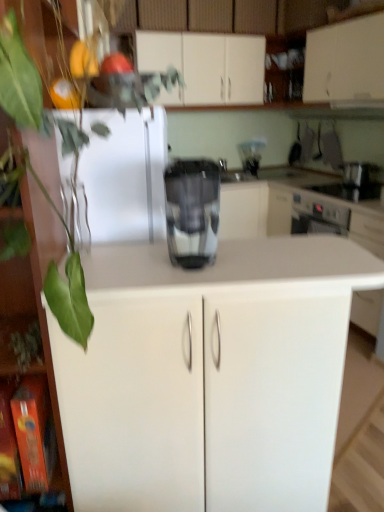
Question: Is metallic silver toaster at upper right, the 1th appliance in the top-to-bottom sequence, outside sleek metallic coffee maker at center?

Choices:
 (A) yes
 (B) no

Answer: (A)

Question: Considering the relative positions of metallic silver toaster at upper right, the 1th appliance in the top-to-bottom sequence, and sleek metallic coffee maker at center in the image provided, is metallic silver toaster at upper right, the 1th appliance in the top-to-bottom sequence, behind sleek metallic coffee maker at center?

Choices:
 (A) no
 (B) yes

Answer: (B)

Question: Is there a large distance between metallic silver toaster at upper right, the 1th appliance in the top-to-bottom sequence, and sleek metallic coffee maker at center?

Choices:
 (A) no
 (B) yes

Answer: (B)

Question: From a real-world perspective, is metallic silver toaster at upper right, marked as the 2th appliance in a bottom-to-top arrangement, located beneath sleek metallic coffee maker at center?

Choices:
 (A) no
 (B) yes

Answer: (B)

Question: Considering the relative sizes of metallic silver toaster at upper right, marked as the 2th appliance in a bottom-to-top arrangement, and sleek metallic coffee maker at center in the image provided, is metallic silver toaster at upper right, marked as the 2th appliance in a bottom-to-top arrangement, thinner than sleek metallic coffee maker at center?

Choices:
 (A) no
 (B) yes

Answer: (A)

Question: Would you say metallic silver toaster at upper right, the 1th appliance in the top-to-bottom sequence, contains sleek metallic coffee maker at center?

Choices:
 (A) no
 (B) yes

Answer: (A)

Question: From the image's perspective, would you say white matte cabinet at upper center, which is the 3th cabinetry in front-to-back order, is shown under green leafy plant at left?

Choices:
 (A) yes
 (B) no

Answer: (B)

Question: Is white matte cabinet at upper center, which is counted as the second cabinetry, starting from the back, taller than green leafy plant at left?

Choices:
 (A) yes
 (B) no

Answer: (B)

Question: From a real-world perspective, is white matte cabinet at upper center, which is counted as the second cabinetry, starting from the back, physically below green leafy plant at left?

Choices:
 (A) yes
 (B) no

Answer: (B)

Question: From the image's perspective, is white matte cabinet at upper center, which is the 3th cabinetry in front-to-back order, above green leafy plant at left?

Choices:
 (A) yes
 (B) no

Answer: (A)

Question: Is white matte cabinet at upper center, which is the 3th cabinetry in front-to-back order, outside green leafy plant at left?

Choices:
 (A) yes
 (B) no

Answer: (A)

Question: Is white matte cabinet at upper center, which is the 3th cabinetry in front-to-back order, not close to green leafy plant at left?

Choices:
 (A) no
 (B) yes

Answer: (B)

Question: Could metallic silver toaster at upper right, marked as the 2th appliance in a bottom-to-top arrangement, be considered to be inside metallic silver coffee maker at center?

Choices:
 (A) yes
 (B) no

Answer: (B)